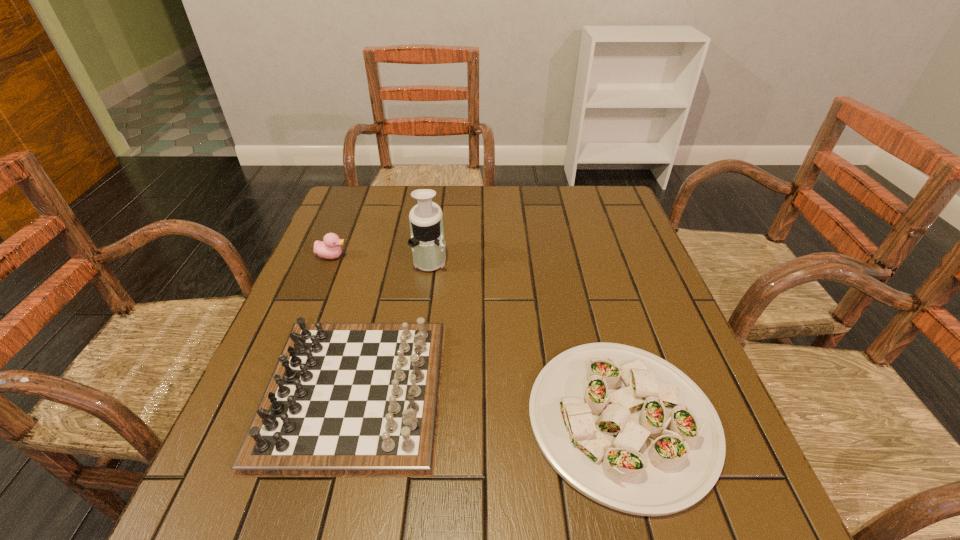
Where is `chessboard situated at the left edge`? The height and width of the screenshot is (540, 960). chessboard situated at the left edge is located at coordinates (345, 399).

Identify the location of duckling present at the left edge. The width and height of the screenshot is (960, 540). (x=329, y=248).

Find the location of `object present at the right edge`. object present at the right edge is located at coordinates click(629, 430).

You are a GUI agent. You are given a task and a screenshot of the screen. Output one action in this format:
    pyautogui.click(x=<x>, y=<y>)
    Task: Click on the object positioned at the near right corner
    
    Given the screenshot: What is the action you would take?
    pyautogui.click(x=629, y=430)

You are a GUI agent. You are given a task and a screenshot of the screen. Output one action in this format:
    pyautogui.click(x=<x>, y=<y>)
    Task: Click on the vacant space at the far edge of the desktop
    The width and height of the screenshot is (960, 540).
    Given the screenshot: What is the action you would take?
    pyautogui.click(x=406, y=191)

In the image, there is a desktop. Where is `vacant space at the right edge`? The height and width of the screenshot is (540, 960). vacant space at the right edge is located at coordinates (653, 271).

Locate an element on the screen. This screenshot has height=540, width=960. vacant space at the far left corner of the desktop is located at coordinates (369, 187).

Image resolution: width=960 pixels, height=540 pixels. I want to click on blank space at the near left corner of the desktop, so click(227, 481).

This screenshot has height=540, width=960. In the image, there is a desktop. What are the coordinates of `vacant space at the far right corner` in the screenshot? It's located at (577, 188).

Find the location of a particular element. vacant space at the near right corner of the desktop is located at coordinates (706, 504).